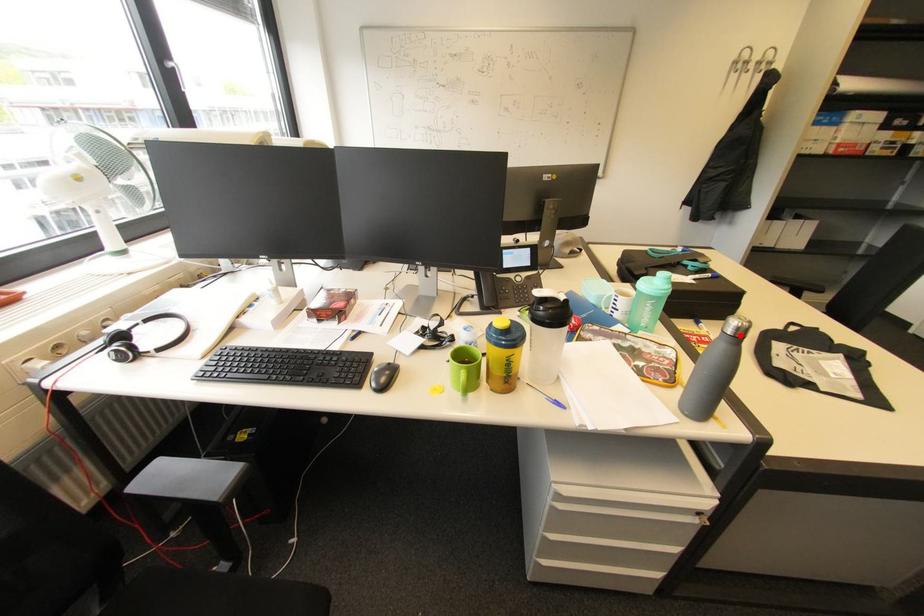
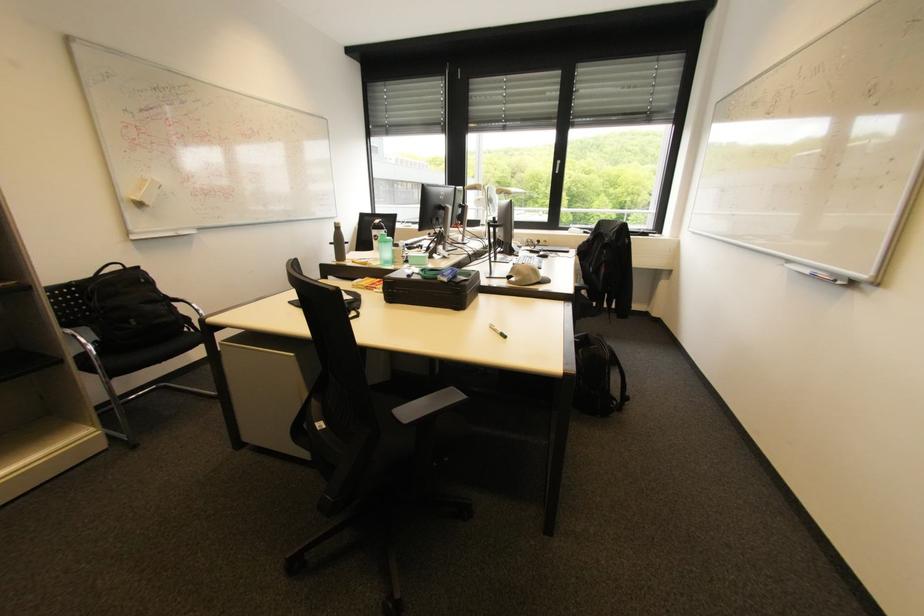
Find the pixel in the second image that matches the highlighted location in the first image.

(342, 228)